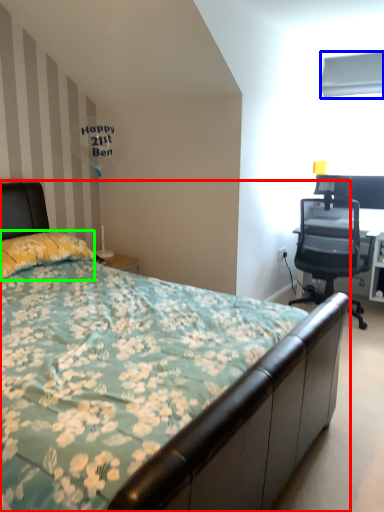
Question: Which object is positioned closest to bed (highlighted by a red box)? Select from window screen (highlighted by a blue box) and pillow (highlighted by a green box).

Choices:
 (A) window screen
 (B) pillow

Answer: (B)